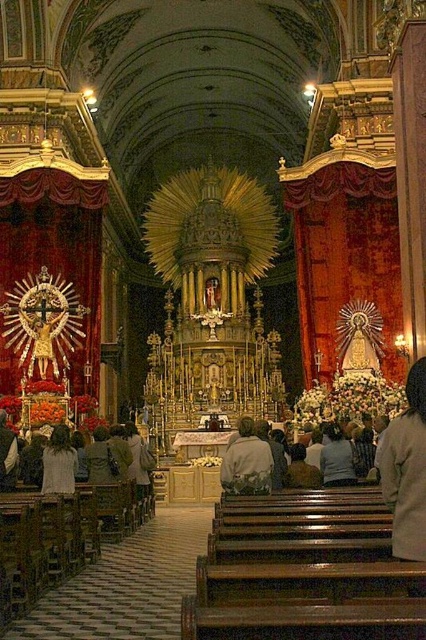
Question: Can you confirm if light beige coat at lower right is positioned to the left of light beige jacket at center?

Choices:
 (A) yes
 (B) no

Answer: (B)

Question: Does light beige coat at lower right have a lesser width compared to light beige jacket at center?

Choices:
 (A) no
 (B) yes

Answer: (A)

Question: Among these objects, which one is nearest to the camera?

Choices:
 (A) light beige jacket at center
 (B) light beige coat at lower right

Answer: (B)

Question: From the image, what is the correct spatial relationship of light beige coat at lower right in relation to light beige jacket at center?

Choices:
 (A) right
 (B) left

Answer: (A)